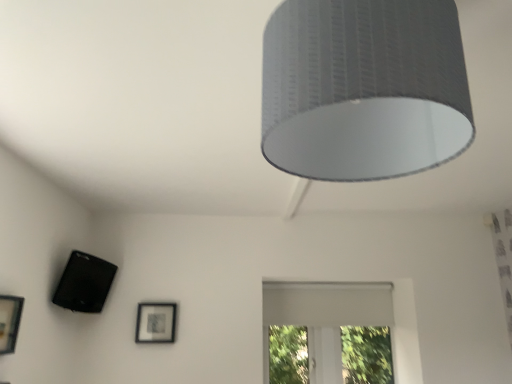
Locate an element on the screen. This screenshot has width=512, height=384. matte black picture frame at lower center, which appears as the first picture frame when viewed from the back is located at coordinates (156, 322).

Identify the location of textured gray lampshade at upper center. (364, 88).

Measure the distance between point (439, 3) and camera.

Point (439, 3) is 29.09 inches from camera.

This screenshot has height=384, width=512. In order to click on matte black picture frame at lower center, placed as the first picture frame when sorted from bottom to top in this screenshot , I will do `click(156, 322)`.

Which is farther from the camera, (12,322) or (169,342)?

Positioned behind is point (169,342).

From a real-world perspective, is matte black picture frame at lower left, positioned as the second picture frame in back-to-front order, under matte black picture frame at lower center, placed as the first picture frame when sorted from bottom to top?

Yes.

Where is `picture frame on the right side of matte black picture frame at lower left, positioned as the second picture frame in back-to-front order`? The image size is (512, 384). picture frame on the right side of matte black picture frame at lower left, positioned as the second picture frame in back-to-front order is located at coordinates (156, 322).

Is matte black picture frame at lower left, arranged as the 2th picture frame when ordered from the bottom, next to matte black picture frame at lower center, placed as the first picture frame when sorted from bottom to top?

There is a gap between matte black picture frame at lower left, arranged as the 2th picture frame when ordered from the bottom, and matte black picture frame at lower center, placed as the first picture frame when sorted from bottom to top.

Is white matte window at center placed right next to matte black picture frame at lower center, which ranks as the second picture frame in top-to-bottom order?

They are not placed beside each other.

Is matte black picture frame at lower center, placed as the first picture frame when sorted from bottom to top, surrounded by white matte window at center?

No, matte black picture frame at lower center, placed as the first picture frame when sorted from bottom to top, is located outside of white matte window at center.

Visually, is white matte window at center positioned to the left or to the right of matte black picture frame at lower center, which appears as the second picture frame when viewed from the front?

Clearly, white matte window at center is on the right of matte black picture frame at lower center, which appears as the second picture frame when viewed from the front, in the image.

Considering the relative sizes of white matte window at center and matte black picture frame at lower center, which appears as the first picture frame when viewed from the back, in the image provided, is white matte window at center smaller than matte black picture frame at lower center, which appears as the first picture frame when viewed from the back,?

No, white matte window at center is not smaller than matte black picture frame at lower center, which appears as the first picture frame when viewed from the back.

From the image's perspective, is matte black picture frame at lower left, acting as the first picture frame starting from the left, located above or below textured gray lampshade at upper center?

From the image's perspective, matte black picture frame at lower left, acting as the first picture frame starting from the left, appears below textured gray lampshade at upper center.

Is matte black picture frame at lower left, the second picture frame from the right, located outside textured gray lampshade at upper center?

Yes, matte black picture frame at lower left, the second picture frame from the right, is located beyond the bounds of textured gray lampshade at upper center.

Are matte black picture frame at lower left, positioned as the second picture frame in back-to-front order, and textured gray lampshade at upper center beside each other?

No.

Based on their sizes in the image, would you say white matte window at center is bigger or smaller than black matte speaker at lower left?

Clearly, white matte window at center is larger in size than black matte speaker at lower left.

Which of these two, white matte window at center or black matte speaker at lower left, is thinner?

white matte window at center is thinner.

From the image's perspective, is white matte window at center located above or below black matte speaker at lower left?

Clearly, from the image's perspective, white matte window at center is below black matte speaker at lower left.

Is white matte window at center turned away from black matte speaker at lower left?

white matte window at center does not have its back to black matte speaker at lower left.

Can you confirm if matte black picture frame at lower center, which ranks as the second picture frame in top-to-bottom order, is taller than white matte window at center?

Incorrect, the height of matte black picture frame at lower center, which ranks as the second picture frame in top-to-bottom order, is not larger of that of white matte window at center.

Is matte black picture frame at lower center, which ranks as the second picture frame in top-to-bottom order, to the left of white matte window at center from the viewer's perspective?

Indeed, matte black picture frame at lower center, which ranks as the second picture frame in top-to-bottom order, is positioned on the left side of white matte window at center.

From the image's perspective, between matte black picture frame at lower center, which appears as the first picture frame when viewed from the back, and white matte window at center, which one is located above?

matte black picture frame at lower center, which appears as the first picture frame when viewed from the back.

Who is more distant, matte black picture frame at lower center, which appears as the first picture frame when viewed from the back, or white matte window at center?

white matte window at center is more distant.

From a real-world perspective, is black matte speaker at lower left physically above matte black picture frame at lower center, which ranks as the second picture frame in top-to-bottom order?

Yes, from a real-world perspective, black matte speaker at lower left is over matte black picture frame at lower center, which ranks as the second picture frame in top-to-bottom order

Is black matte speaker at lower left to the left or to the right of matte black picture frame at lower center, which ranks as the second picture frame in top-to-bottom order, in the image?

From the image, it's evident that black matte speaker at lower left is to the left of matte black picture frame at lower center, which ranks as the second picture frame in top-to-bottom order.

Is matte black picture frame at lower center, which ranks as the second picture frame in top-to-bottom order, at the back of black matte speaker at lower left?

No, matte black picture frame at lower center, which ranks as the second picture frame in top-to-bottom order, is not at the back of black matte speaker at lower left.

Considering their positions, is black matte speaker at lower left located in front of or behind matte black picture frame at lower center, which appears as the second picture frame when viewed from the front?

Visually, black matte speaker at lower left is located in front of matte black picture frame at lower center, which appears as the second picture frame when viewed from the front.

Is textured gray lampshade at upper center far away from matte black picture frame at lower center, positioned as the 1th picture frame in right-to-left order?

Yes, textured gray lampshade at upper center is far from matte black picture frame at lower center, positioned as the 1th picture frame in right-to-left order.

Which is more to the left, textured gray lampshade at upper center or matte black picture frame at lower center, placed as the first picture frame when sorted from bottom to top?

Positioned to the left is matte black picture frame at lower center, placed as the first picture frame when sorted from bottom to top.

Which of these two, textured gray lampshade at upper center or matte black picture frame at lower center, which ranks as the second picture frame in top-to-bottom order, is thinner?

Thinner between the two is matte black picture frame at lower center, which ranks as the second picture frame in top-to-bottom order.

From the image's perspective, which one is positioned lower, textured gray lampshade at upper center or matte black picture frame at lower center, which is the second picture frame from left to right?

matte black picture frame at lower center, which is the second picture frame from left to right, appears lower in the image.

The image size is (512, 384). I want to click on picture frame that is above the matte black picture frame at lower left, the second picture frame from the right (from a real-world perspective), so point(156,322).

The image size is (512, 384). I want to click on window that appears below the matte black picture frame at lower center, which appears as the first picture frame when viewed from the back (from the image's perspective), so click(x=324, y=317).

Considering their positions, is matte black picture frame at lower left, acting as the first picture frame starting from the left, positioned further to white matte window at center than textured gray lampshade at upper center?

textured gray lampshade at upper center lies further to white matte window at center than the other object.

Estimate the real-world distances between objects in this image. Which object is closer to matte black picture frame at lower left, the second picture frame from the right, white matte window at center or black matte speaker at lower left?

black matte speaker at lower left is positioned closer to the anchor matte black picture frame at lower left, the second picture frame from the right.

Estimate the real-world distances between objects in this image. Which object is further from textured gray lampshade at upper center, white matte window at center or matte black picture frame at lower left, acting as the first picture frame starting from the left?

Among the two, white matte window at center is located further to textured gray lampshade at upper center.

From the image, which object appears to be farther from black matte speaker at lower left, white matte window at center or textured gray lampshade at upper center?

Based on the image, textured gray lampshade at upper center appears to be further to black matte speaker at lower left.

Looking at the image, which one is located closer to white matte window at center, matte black picture frame at lower center, which appears as the first picture frame when viewed from the back, or black matte speaker at lower left?

matte black picture frame at lower center, which appears as the first picture frame when viewed from the back, is closer to white matte window at center.

Considering their positions, is matte black picture frame at lower left, the second picture frame from the right, positioned further to black matte speaker at lower left than white matte window at center?

The object further to black matte speaker at lower left is white matte window at center.

From the picture: Looking at the image, which one is located further to matte black picture frame at lower center, placed as the first picture frame when sorted from bottom to top, black matte speaker at lower left or matte black picture frame at lower left, the 1th picture frame in the top-to-bottom sequence?

Among the two, matte black picture frame at lower left, the 1th picture frame in the top-to-bottom sequence, is located further to matte black picture frame at lower center, placed as the first picture frame when sorted from bottom to top.

When comparing their distances from matte black picture frame at lower center, which appears as the second picture frame when viewed from the front, does textured gray lampshade at upper center or matte black picture frame at lower left, acting as the first picture frame starting from the left, seem closer?

matte black picture frame at lower left, acting as the first picture frame starting from the left.

Find the location of a particular element. The image size is (512, 384). picture frame between textured gray lampshade at upper center and matte black picture frame at lower center, positioned as the 1th picture frame in right-to-left order, from front to back is located at coordinates (9, 322).

At what (x,y) coordinates should I click in order to perform the action: click on speaker located between textured gray lampshade at upper center and white matte window at center in the depth direction. Please return your answer as a coordinate pair (x, y). This screenshot has width=512, height=384. Looking at the image, I should click on (84, 283).

Locate an element on the screen. The height and width of the screenshot is (384, 512). picture frame between textured gray lampshade at upper center and black matte speaker at lower left along the z-axis is located at coordinates (9, 322).

Locate an element on the screen. The image size is (512, 384). speaker between matte black picture frame at lower left, the 1th picture frame in the top-to-bottom sequence, and white matte window at center, in the horizontal direction is located at coordinates (84, 283).